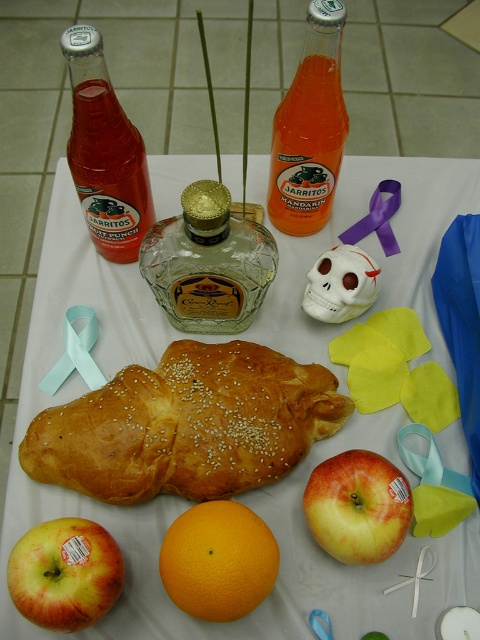
Is orangesmoothorange at center shorter than red matte apple at center?

Indeed, orangesmoothorange at center has a lesser height compared to red matte apple at center.

Can you confirm if orangesmoothorange at center is positioned to the right of red matte apple at center?

Incorrect, orangesmoothorange at center is not on the right side of red matte apple at center.

Describe the element at coordinates (217, 561) in the screenshot. This screenshot has height=640, width=480. I see `orangesmoothorange at center` at that location.

Where is `orangesmoothorange at center`? orangesmoothorange at center is located at coordinates (217, 561).

What are the coordinates of `clear glass bottle at center` in the screenshot? It's located at (207, 262).

Can you confirm if clear glass bottle at center is smaller than red matte apple at center?

No.

Which is in front, point (164, 280) or point (383, 525)?

Positioned in front is point (383, 525).

Where is `clear glass bottle at center`? The width and height of the screenshot is (480, 640). clear glass bottle at center is located at coordinates pos(207,262).

Who is more forward, (302, 433) or (245, 557)?

Point (245, 557) is in front.

Which is in front, point (282, 403) or point (228, 611)?

Positioned in front is point (228, 611).

Image resolution: width=480 pixels, height=640 pixels. In order to click on golden brown crusty loaf at center in this screenshot , I will do `click(187, 426)`.